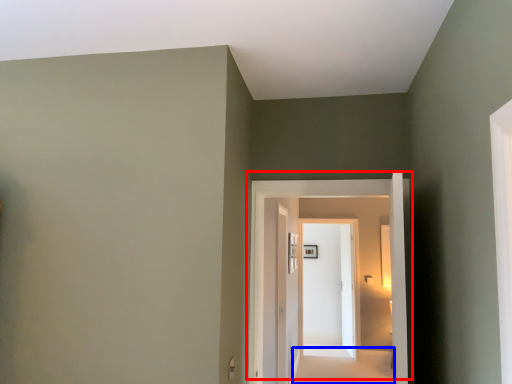
Question: Which object is closer to the camera taking this photo, door (highlighted by a red box) or path (highlighted by a blue box)?

Choices:
 (A) door
 (B) path

Answer: (A)